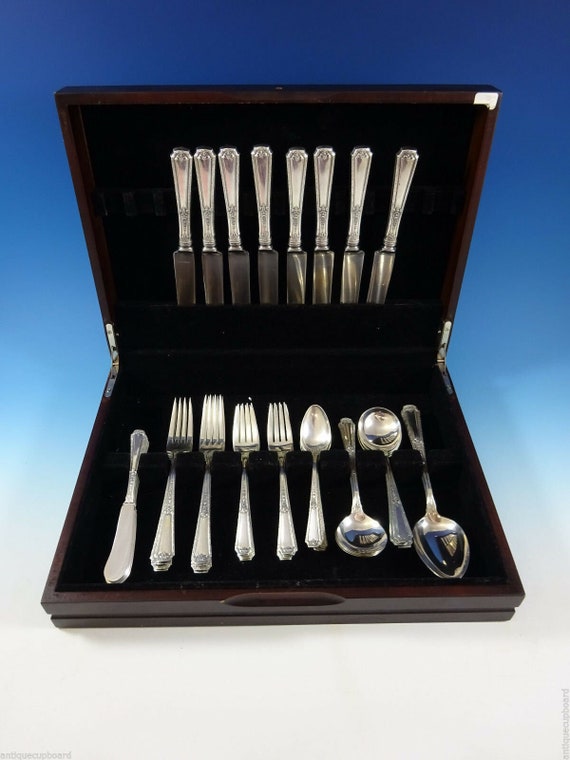
At what (x,y) coordinates should I click in order to perform the action: click on spoons shown. Please return your answer as a coordinate pair (x, y). Looking at the image, I should click on (446, 540), (386, 428), (358, 527), (324, 437).